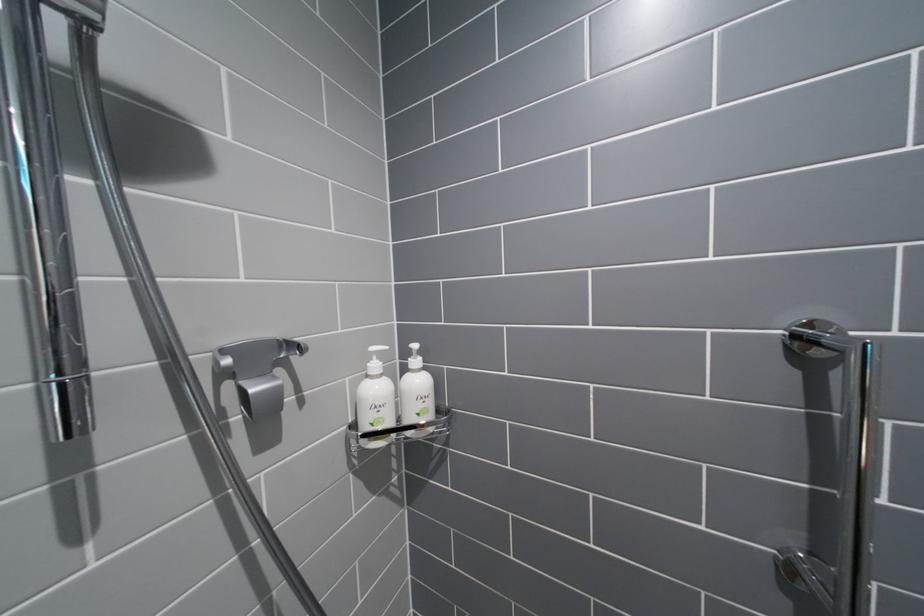
Find where to lift the shower valve handle. Please return your answer as a coordinate pair (x, y).

(256, 371)